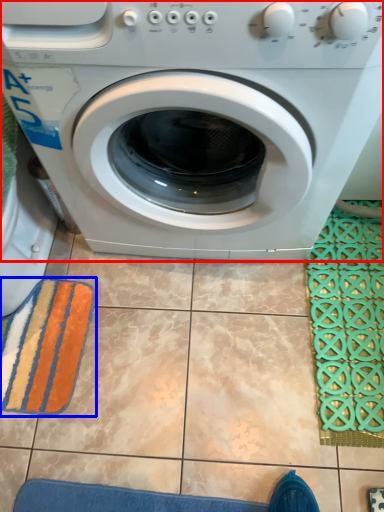
Question: Among these objects, which one is farthest to the camera, washing machine (highlighted by a red box) or bath towel (highlighted by a blue box)?

Choices:
 (A) washing machine
 (B) bath towel

Answer: (B)